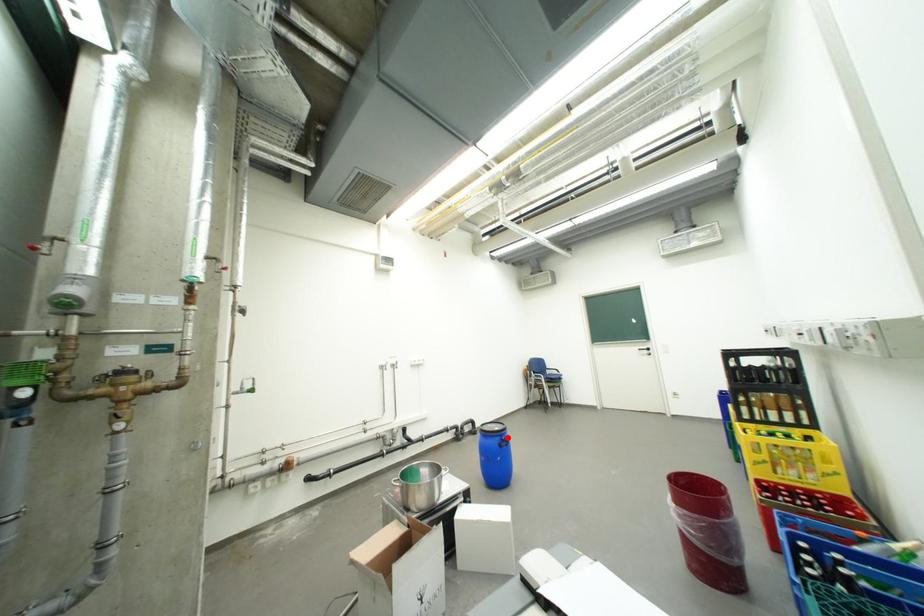
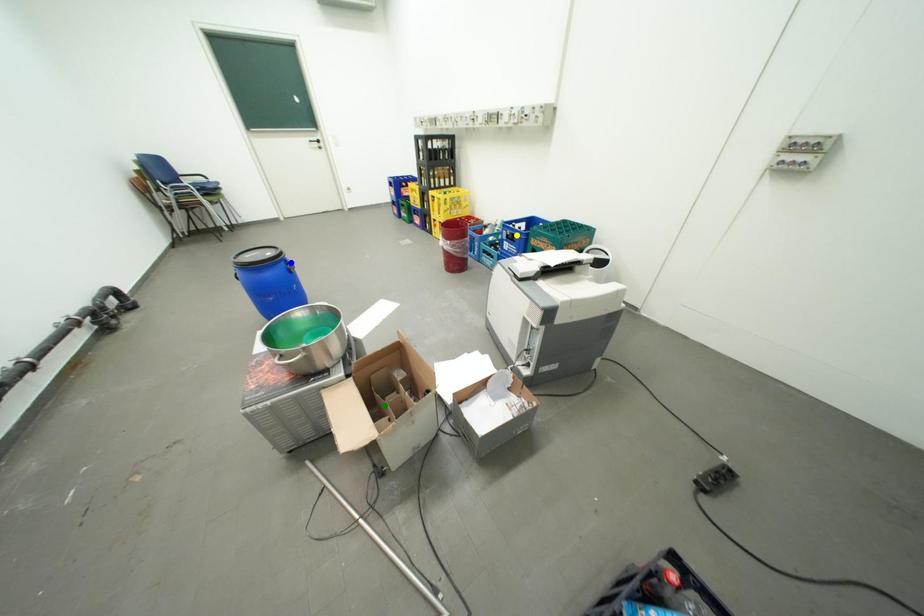
Question: I am providing you with two images of the same scene from different viewpoints. A red point is marked on the first image. You are given multiple points on the second image. Which spot in image 2 lines up with the point in image 1?

Choices:
 (A) blue point
 (B) green point
 (C) yellow point

Answer: (A)